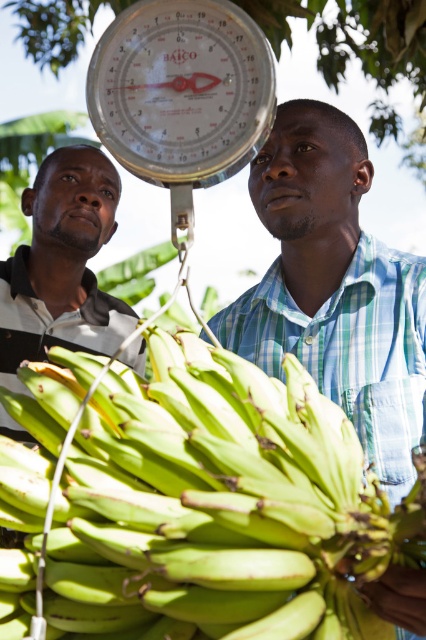
In the scene shown: How distant is green plaid shirt at center from white metallic scale at center?

green plaid shirt at center is 37.44 inches away from white metallic scale at center.

Is point (232, 314) less distant than point (227, 28)?

That is False.

At what (x,y) coordinates should I click in order to perform the action: click on green plaid shirt at center. Please return your answer as a coordinate pair (x, y). Looking at the image, I should click on (334, 288).

Can you confirm if white metallic scale at center is bigger than striped cotton shirt at left?

No.

Between point (167, 44) and point (74, 337), which one is positioned in front?

Point (167, 44) is in front.

Measure the distance between point [163,1] and camera.

The distance of point [163,1] from camera is 5.14 feet.

Identify the location of white metallic scale at center. The width and height of the screenshot is (426, 640). (181, 96).

Based on the photo, is green matte bananas at center thinner than striped cotton shirt at left?

Indeed, green matte bananas at center has a lesser width compared to striped cotton shirt at left.

Who is positioned more to the right, green matte bananas at center or striped cotton shirt at left?

From the viewer's perspective, green matte bananas at center appears more on the right side.

Is point (327, 417) positioned in front of point (28, 436)?

That is True.

Image resolution: width=426 pixels, height=640 pixels. In order to click on green matte bananas at center in this screenshot , I will do `click(219, 508)`.